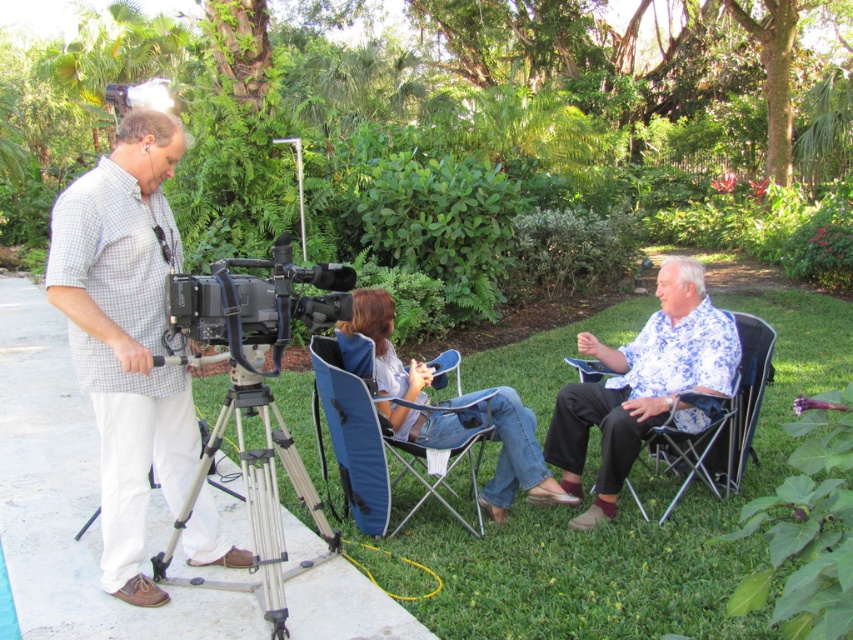
Between checkered fabric shirt at left and black plastic camera at center, which one appears on the left side from the viewer's perspective?

checkered fabric shirt at left is more to the left.

Can you confirm if checkered fabric shirt at left is positioned above black plastic camera at center?

Actually, checkered fabric shirt at left is below black plastic camera at center.

What do you see at coordinates (126, 336) in the screenshot?
I see `checkered fabric shirt at left` at bounding box center [126, 336].

What are the coordinates of `checkered fabric shirt at left` in the screenshot? It's located at (126, 336).

Is point (279, 515) farther from viewer compared to point (419, 502)?

No, (279, 515) is closer to viewer.

Does point (289, 436) come in front of point (380, 534)?

That is True.

The height and width of the screenshot is (640, 853). I want to click on silver metallic tripod at lower left, so click(256, 499).

Can you confirm if blue floral shirt at center is smaller than denim jeans at center?

Indeed, blue floral shirt at center has a smaller size compared to denim jeans at center.

Is blue floral shirt at center wider than denim jeans at center?

No, blue floral shirt at center is not wider than denim jeans at center.

Describe the element at coordinates (643, 385) in the screenshot. Image resolution: width=853 pixels, height=640 pixels. I see `blue floral shirt at center` at that location.

Identify the location of blue floral shirt at center. The width and height of the screenshot is (853, 640). (643, 385).